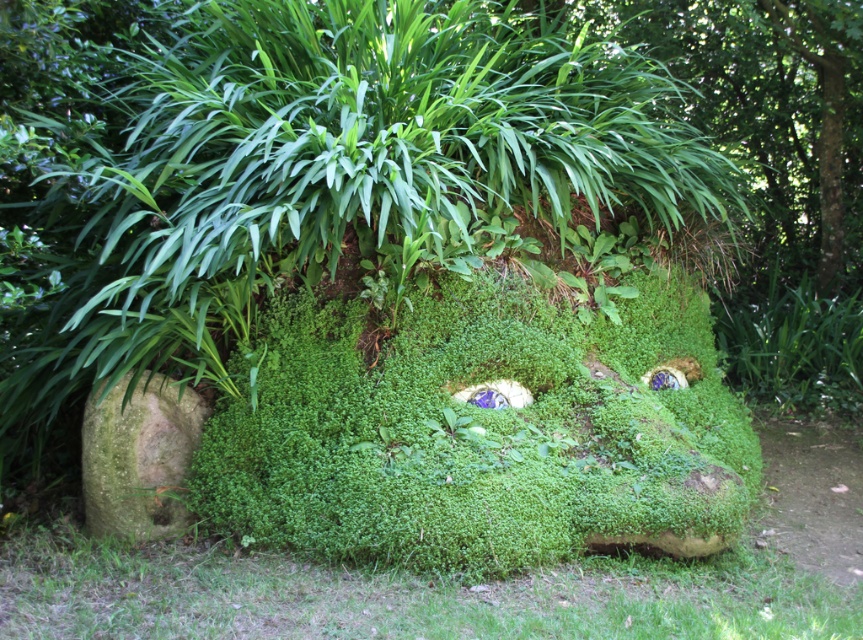
You are standing in front of the sculpture and want to touch both the green mossy rock at lower center and the green mossy rock at lower left. Which one should you reach for first to touch the one closer to you?

You should reach for the green mossy rock at lower center first because it is closer to you than the green mossy rock at lower left.

You are an artist standing in front of the sculpture and want to paint the green mossy rock at lower center and the green mossy rock at lower left. Which one is positioned to the right of the other?

The green mossy rock at lower center is positioned to the right of the green mossy rock at lower left.

You are an archaeologist examining the sculpture. You notice a point marked at coordinates (399, 595). Based on the scene, what does this point likely represent?

The point at coordinates (399, 595) represents the green mossy rock at lower center.